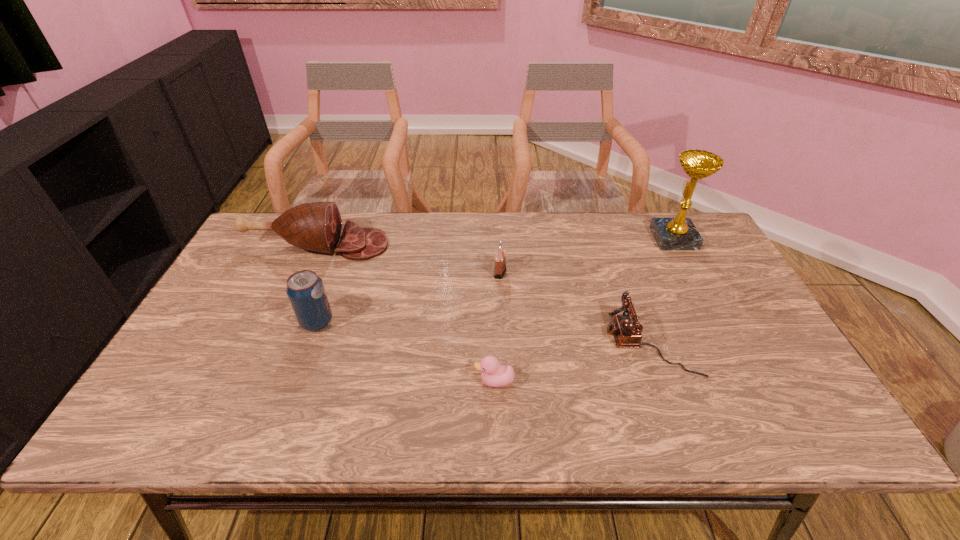
Locate an element on the screen. unoccupied position between the ham and the duckling is located at coordinates (406, 313).

Where is `object that stands as the fourth closest to the third farthest object`? The image size is (960, 540). object that stands as the fourth closest to the third farthest object is located at coordinates (305, 290).

Select which object appears as the fourth closest to the padlock. Please provide its 2D coordinates. Your answer should be formatted as a tuple, i.e. [(x, y)], where the tuple contains the x and y coordinates of a point satisfying the conditions above.

[(305, 290)]

Find the location of a particular element. vacant point that satisfies the following two spatial constraints: 1. at the sliced end of the ham; 2. on the back side of the padlock is located at coordinates (305, 272).

Where is `blank space that satisfies the following two spatial constraints: 1. on the front side of the fourth nearest object; 2. on the front-facing side of the shortest object`? blank space that satisfies the following two spatial constraints: 1. on the front side of the fourth nearest object; 2. on the front-facing side of the shortest object is located at coordinates (506, 381).

You are a GUI agent. You are given a task and a screenshot of the screen. Output one action in this format:
    pyautogui.click(x=<x>, y=<y>)
    Task: Click on the free location that satisfies the following two spatial constraints: 1. on the back side of the pop soda; 2. on the right side of the padlock
    The width and height of the screenshot is (960, 540).
    Given the screenshot: What is the action you would take?
    pos(335,272)